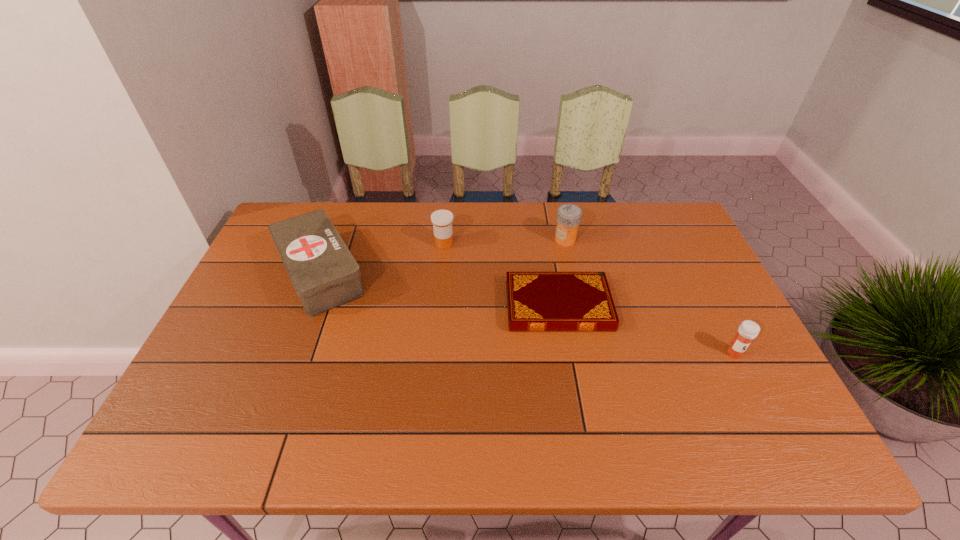
The image size is (960, 540). Identify the location of empty space between the shortest object and the leftmost object. (440, 289).

Where is `the third closest object to the hardback book`? the third closest object to the hardback book is located at coordinates (748, 330).

Image resolution: width=960 pixels, height=540 pixels. What are the coordinates of `the second closest object relative to the rightmost medicine` in the screenshot? It's located at (569, 216).

Locate an element on the screen. the second closest medicine to the rightmost medicine is located at coordinates (442, 220).

Locate which medicine is the second closest to the rightmost medicine. Please provide its 2D coordinates. Your answer should be formatted as a tuple, i.e. [(x, y)], where the tuple contains the x and y coordinates of a point satisfying the conditions above.

[(442, 220)]